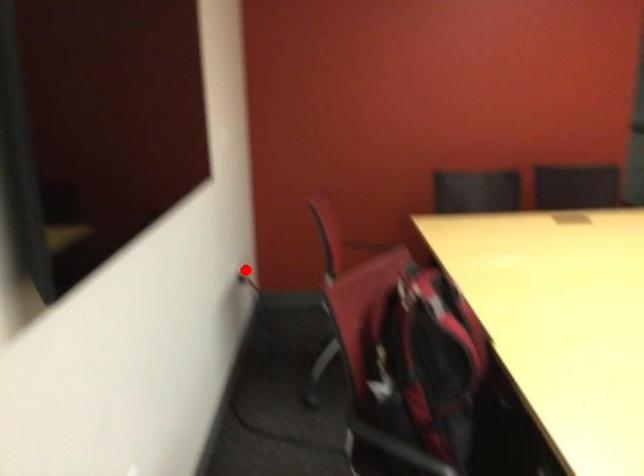
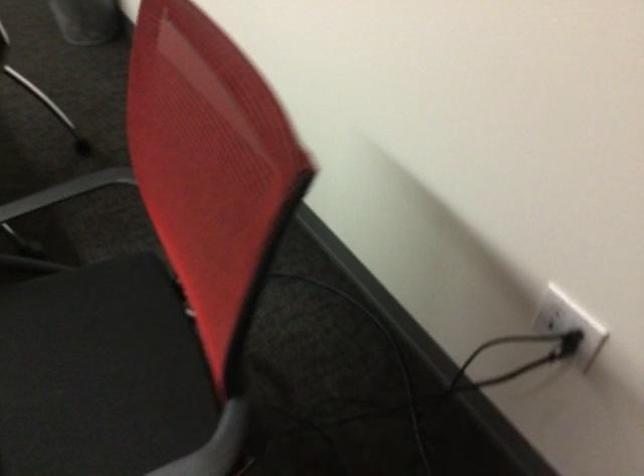
In the second image, find the point that corresponds to the highlighted location in the first image.

(554, 312)